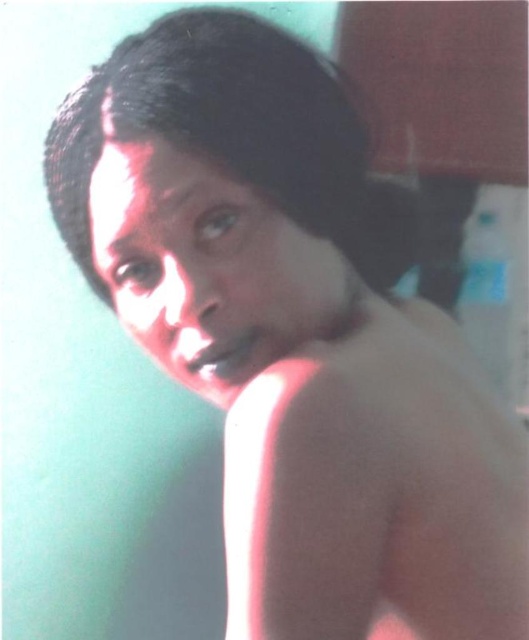
Is smooth skin at right in front of black matte hair at center?

Yes, smooth skin at right is in front of black matte hair at center.

The width and height of the screenshot is (529, 640). Describe the element at coordinates (377, 492) in the screenshot. I see `smooth skin at right` at that location.

Does point (460, 372) come behind point (203, 77)?

Yes, point (460, 372) is behind point (203, 77).

The height and width of the screenshot is (640, 529). Find the location of `smooth skin at right`. smooth skin at right is located at coordinates (377, 492).